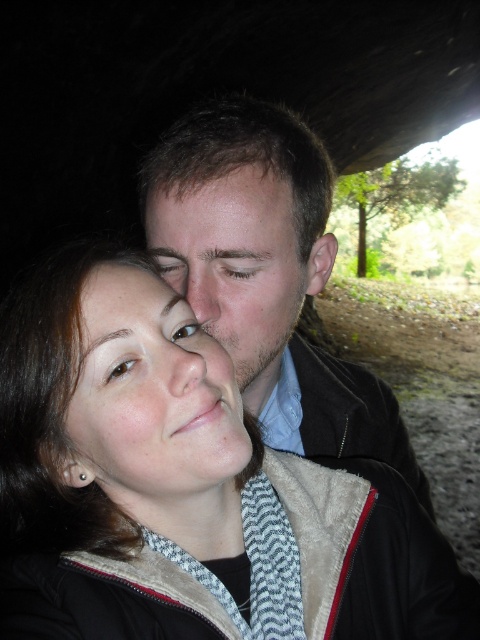
Is smooth black jacket at upper center positioned in front of smooth skin face at upper center?

Yes, smooth black jacket at upper center is in front of smooth skin face at upper center.

Can you confirm if smooth black jacket at upper center is positioned to the left of smooth skin face at upper center?

Incorrect, smooth black jacket at upper center is not on the left side of smooth skin face at upper center.

Is point (284, 374) closer to camera compared to point (219, 198)?

No, it is not.

Locate an element on the screen. smooth black jacket at upper center is located at coordinates (265, 275).

Is point (219, 246) closer to viewer compared to point (183, 208)?

That is True.

Consider the image. Is smooth black jacket at upper center taller than matte skin at center?

Correct, smooth black jacket at upper center is much taller as matte skin at center.

Locate an element on the screen. This screenshot has width=480, height=640. smooth black jacket at upper center is located at coordinates (265, 275).

Does smooth black jacket at upper center have a lesser width compared to smooth skin face at center?

No, smooth black jacket at upper center is not thinner than smooth skin face at center.

Does point (219, 294) lie behind point (74, 472)?

Yes.

Does point (302, 440) come in front of point (235, 484)?

No, (302, 440) is further to viewer.

The height and width of the screenshot is (640, 480). Identify the location of smooth black jacket at upper center. (265, 275).